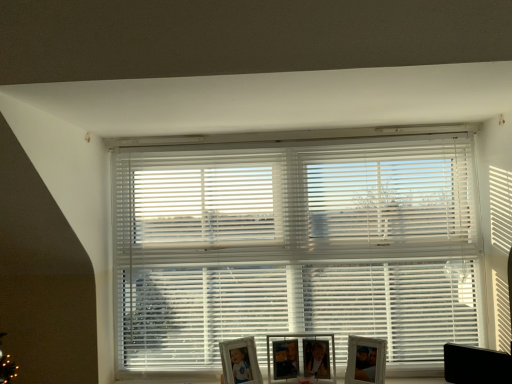
Question: Does point (324, 274) appear closer or farther from the camera than point (353, 354)?

Choices:
 (A) closer
 (B) farther

Answer: (B)

Question: Visually, is white plastic blinds at center positioned to the left or to the right of wooden photo frame at lower right, acting as the first picture frame starting from the right?

Choices:
 (A) left
 (B) right

Answer: (A)

Question: Which object is the closest to the black plastic swivel chair at lower right?

Choices:
 (A) white plastic blinds at center
 (B) matte silver picture frame at lower center, the 3th picture frame in the right-to-left sequence
 (C) wooden photo frame at lower right, the 3th picture frame positioned from the left
 (D) wooden photo frame at center, which ranks as the second picture frame in right-to-left order

Answer: (C)

Question: Considering the real-world distances, which object is closest to the wooden photo frame at center, which ranks as the second picture frame in right-to-left order?

Choices:
 (A) white plastic blinds at center
 (B) black plastic swivel chair at lower right
 (C) matte silver picture frame at lower center, the 3th picture frame in the right-to-left sequence
 (D) wooden photo frame at lower right, acting as the first picture frame starting from the right

Answer: (C)